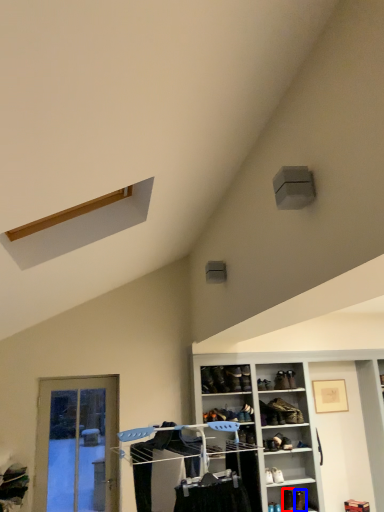
Question: Which object is closer to the camera taking this photo, shoe (highlighted by a red box) or shoe (highlighted by a blue box)?

Choices:
 (A) shoe
 (B) shoe

Answer: (B)